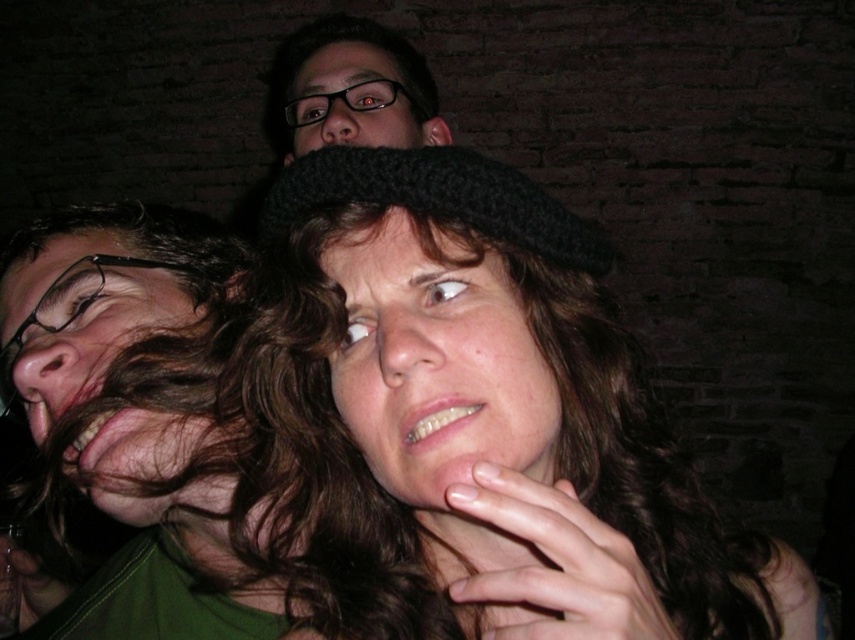
Question: Is knitted woolen hat at center positioned before brown hair at left?

Choices:
 (A) no
 (B) yes

Answer: (B)

Question: Is black knitted hat at center smaller than brown hair at left?

Choices:
 (A) no
 (B) yes

Answer: (A)

Question: Among these points, which one is farthest from the camera?

Choices:
 (A) (388, 112)
 (B) (373, 346)
 (C) (407, 481)
 (D) (199, 307)

Answer: (A)

Question: Can you confirm if brown hair at left is positioned to the left of matte black glasses at upper center?

Choices:
 (A) no
 (B) yes

Answer: (B)

Question: Which of the following is the closest to the observer?

Choices:
 (A) brown hair at left
 (B) matte black glasses at upper center

Answer: (A)

Question: Considering the real-world distances, which object is closest to the brown hair at left?

Choices:
 (A) knitted woolen hat at center
 (B) matte black glasses at upper center

Answer: (A)